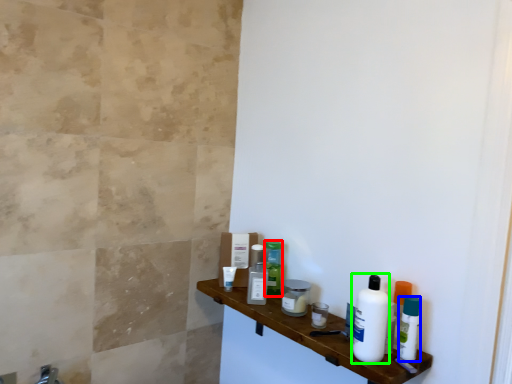
Question: Which object is the closest to the toiletry (highlighted by a red box)? Choose among these: mouthwash (highlighted by a blue box) or cleaning product (highlighted by a green box).

Choices:
 (A) mouthwash
 (B) cleaning product

Answer: (B)